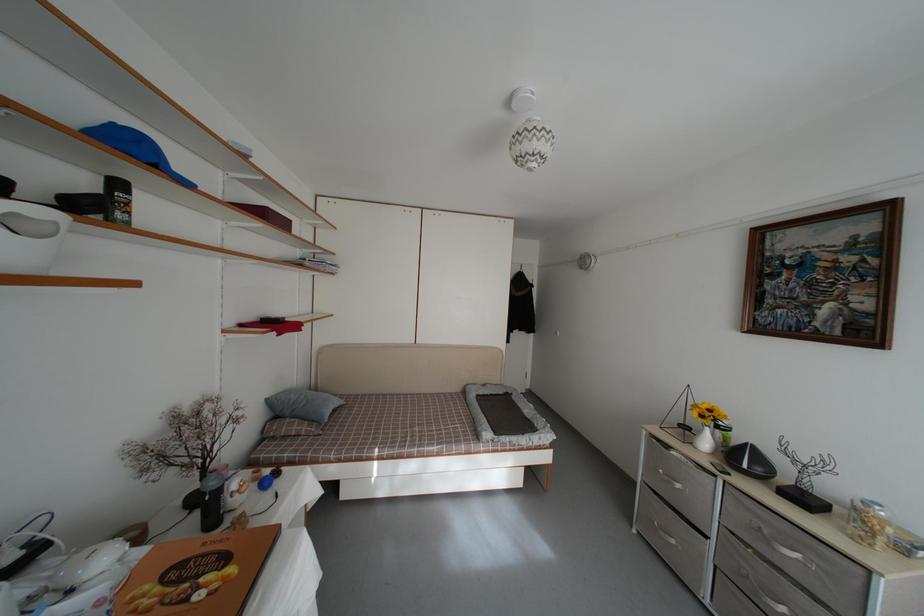
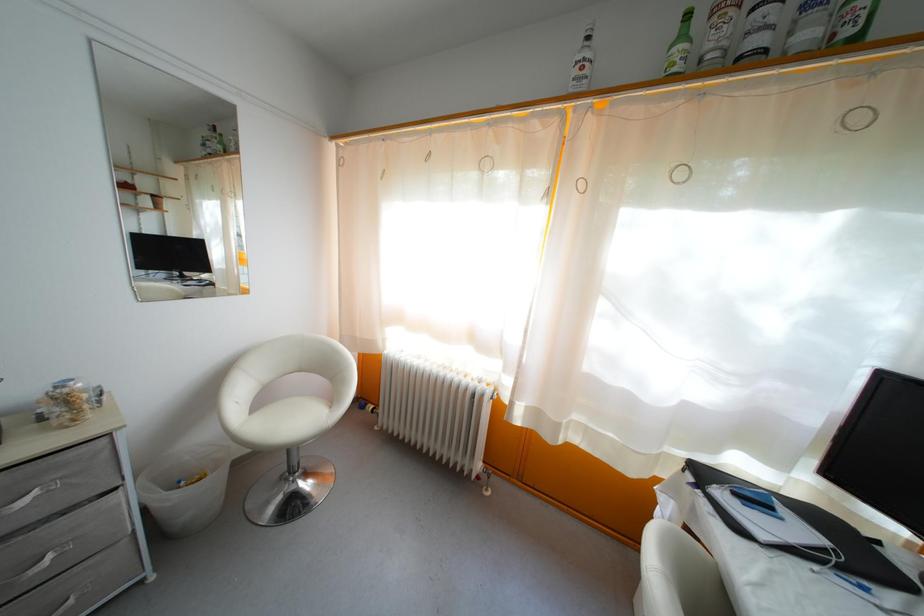
Locate, in the second image, the point that corresponds to [865,576] in the first image.

(110, 447)